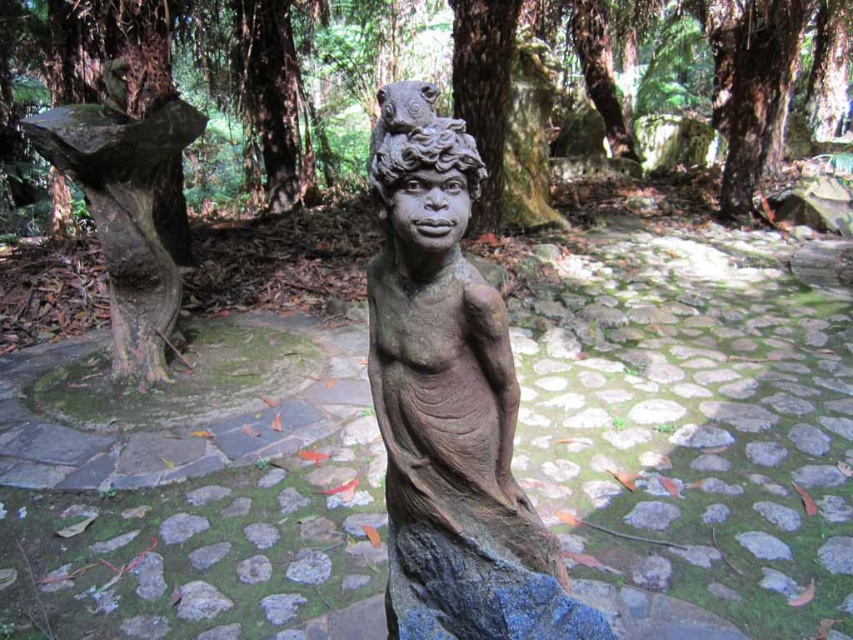
Question: Which of the following is the closest to the observer?

Choices:
 (A) (108, 44)
 (B) (115, 154)
 (C) (434, 419)

Answer: (C)

Question: In this image, where is brown stone statue at center located relative to green mossy tree stump at left?

Choices:
 (A) left
 (B) right

Answer: (B)

Question: Is brown stone statue at center to the left of green mossy tree stump at left from the viewer's perspective?

Choices:
 (A) yes
 (B) no

Answer: (B)

Question: Is brown stone statue at center thinner than smooth bark tree trunk at center?

Choices:
 (A) yes
 (B) no

Answer: (A)

Question: Which object is farther from the camera taking this photo?

Choices:
 (A) brown stone statue at center
 (B) green mossy tree stump at left
 (C) smooth bark tree trunk at center

Answer: (C)

Question: Among these points, which one is nearest to the camera?

Choices:
 (A) (165, 129)
 (B) (473, 467)
 (C) (373, 61)

Answer: (B)